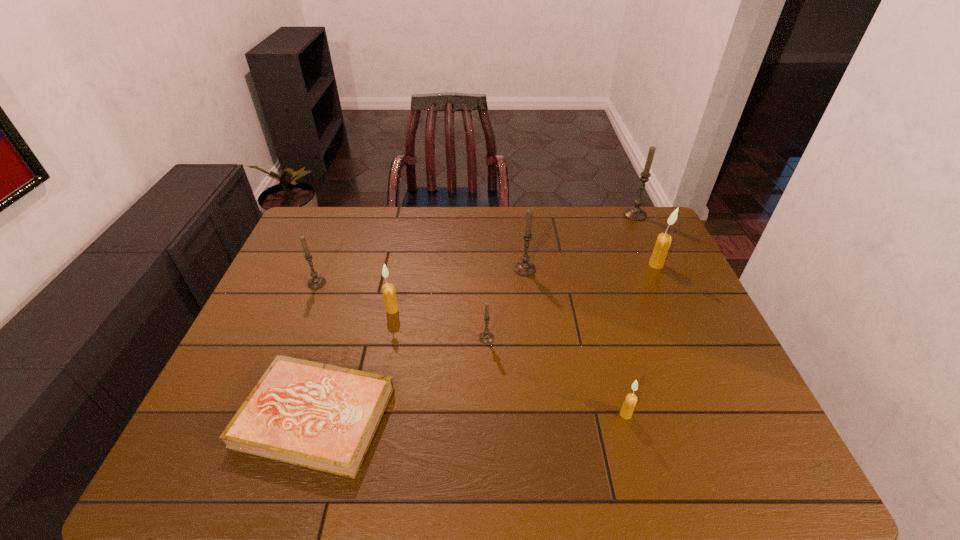
Select which gray candle is the closest to the tallest candle. Please provide its 2D coordinates. Your answer should be formatted as a tuple, i.e. [(x, y)], where the tuple contains the x and y coordinates of a point satisfying the conditions above.

[(524, 268)]

Locate an element on the screen. This screenshot has width=960, height=540. the second closest cream candle to the smallest gray candle is located at coordinates (629, 404).

You are a GUI agent. You are given a task and a screenshot of the screen. Output one action in this format:
    pyautogui.click(x=<x>, y=<y>)
    Task: Click on the cream candle that is the second closest to the leftmost gray candle
    
    Given the screenshot: What is the action you would take?
    pyautogui.click(x=629, y=404)

I want to click on free space that satisfies the following two spatial constraints: 1. on the back side of the second smallest gray candle; 2. on the right side of the second gray candle from right to left, so click(323, 269).

You are a GUI agent. You are given a task and a screenshot of the screen. Output one action in this format:
    pyautogui.click(x=<x>, y=<y>)
    Task: Click on the vacant space that satisfies the following two spatial constraints: 1. on the back side of the second farthest gray candle; 2. on the right side of the fifth farthest object
    The height and width of the screenshot is (540, 960).
    Given the screenshot: What is the action you would take?
    pyautogui.click(x=400, y=269)

This screenshot has height=540, width=960. What are the coordinates of `blank area in the image that satisfies the following two spatial constraints: 1. on the front side of the third farthest gray candle; 2. on the left side of the nearest cream candle` in the screenshot? It's located at (264, 414).

Where is `free location that satisfies the following two spatial constraints: 1. on the front side of the leftmost cream candle; 2. on the left side of the second cream candle from left to right`? free location that satisfies the following two spatial constraints: 1. on the front side of the leftmost cream candle; 2. on the left side of the second cream candle from left to right is located at coordinates (371, 414).